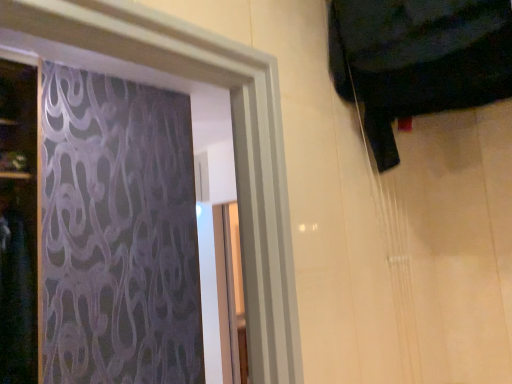
Question: Is dark wood door at left at the back of black fabric at upper right?

Choices:
 (A) no
 (B) yes

Answer: (A)

Question: Does black fabric at upper right appear on the left side of dark wood door at left?

Choices:
 (A) yes
 (B) no

Answer: (B)

Question: From the image's perspective, is black fabric at upper right over dark wood door at left?

Choices:
 (A) no
 (B) yes

Answer: (B)

Question: Can you confirm if black fabric at upper right is wider than dark wood door at left?

Choices:
 (A) yes
 (B) no

Answer: (B)

Question: Does black fabric at upper right have a smaller size compared to dark wood door at left?

Choices:
 (A) yes
 (B) no

Answer: (A)

Question: Is black fabric at upper right outside dark wood door at left?

Choices:
 (A) yes
 (B) no

Answer: (A)

Question: From a real-world perspective, is dark wood door at left located beneath black fabric at upper right?

Choices:
 (A) no
 (B) yes

Answer: (B)

Question: Does dark wood door at left have a smaller size compared to black fabric at upper right?

Choices:
 (A) no
 (B) yes

Answer: (A)

Question: From a real-world perspective, is dark wood door at left over black fabric at upper right?

Choices:
 (A) no
 (B) yes

Answer: (A)

Question: Does dark wood door at left have a larger size compared to black fabric at upper right?

Choices:
 (A) no
 (B) yes

Answer: (B)

Question: Can you confirm if dark wood door at left is thinner than black fabric at upper right?

Choices:
 (A) yes
 (B) no

Answer: (B)

Question: Is dark wood door at left beside black fabric at upper right?

Choices:
 (A) no
 (B) yes

Answer: (A)

Question: In terms of height, does black fabric at upper right look taller or shorter compared to dark wood door at left?

Choices:
 (A) tall
 (B) short

Answer: (B)